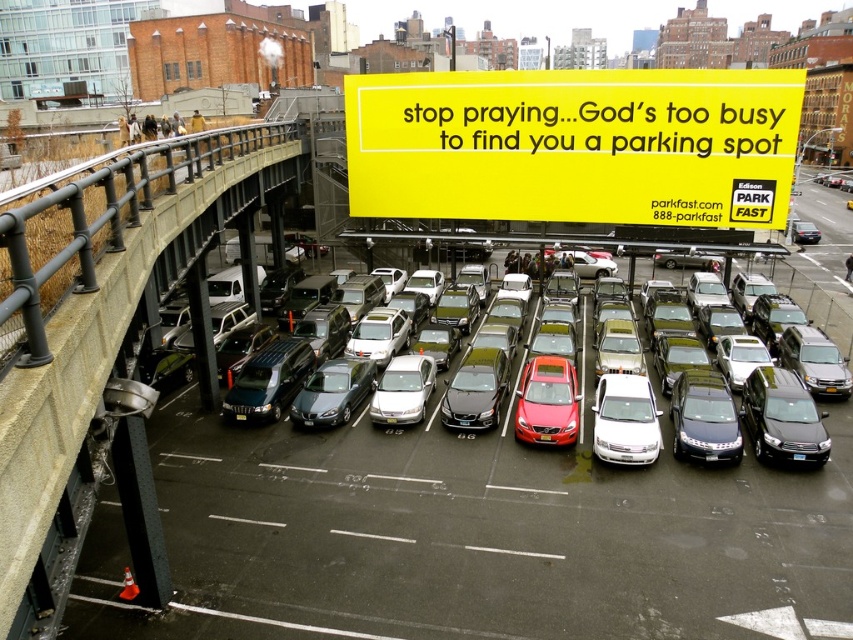
Is yellow paper sign at upper center to the left of metallic gray sedan at center from the viewer's perspective?

Incorrect, yellow paper sign at upper center is not on the left side of metallic gray sedan at center.

Which of these two, yellow paper sign at upper center or metallic gray sedan at center, stands taller?

yellow paper sign at upper center

Does point (465, 97) lie behind point (364, 362)?

Yes.

This screenshot has height=640, width=853. I want to click on yellow paper sign at upper center, so click(575, 145).

Does point (827, 435) lie in front of point (706, 401)?

Yes, it is in front of point (706, 401).

Between shiny black sedan at center and satin black sedan at center, which one appears on the right side from the viewer's perspective?

Positioned to the right is shiny black sedan at center.

I want to click on shiny black sedan at center, so click(x=782, y=417).

Who is shorter, yellow paper sign at upper center or shiny black sedan at center?

shiny black sedan at center

Is yellow paper sign at upper center to the left of shiny black sedan at center from the viewer's perspective?

Yes, yellow paper sign at upper center is to the left of shiny black sedan at center.

What do you see at coordinates (575, 145) in the screenshot?
I see `yellow paper sign at upper center` at bounding box center [575, 145].

Locate an element on the screen. This screenshot has height=640, width=853. yellow paper sign at upper center is located at coordinates (575, 145).